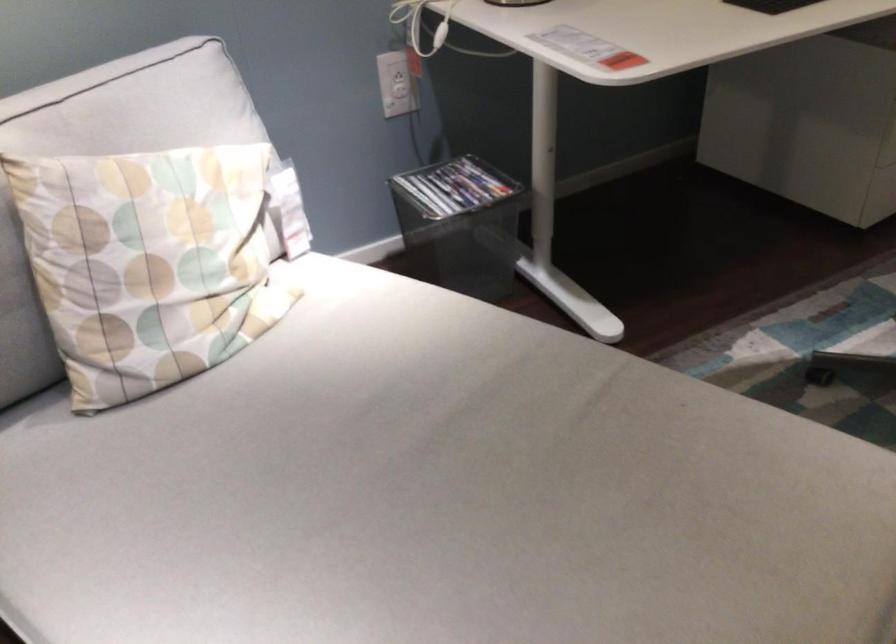
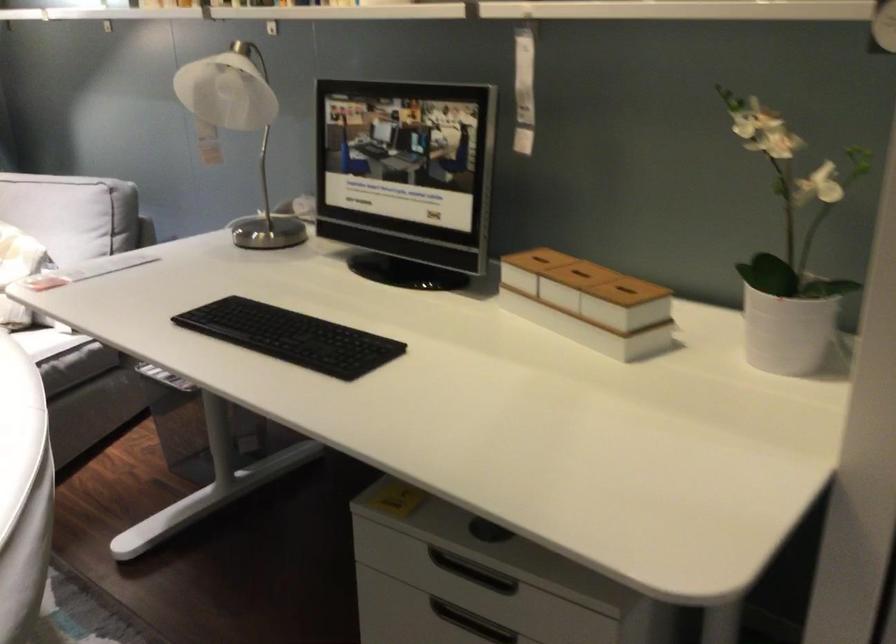
Question: I am providing you with two images of the same scene from different viewpoints. After the viewpoint changes to image2, which objects are now occluded?

Choices:
 (A) black keyboard
 (B) cabinet drawer handle
 (C) black handbag
 (D) white cable plug

Answer: (D)